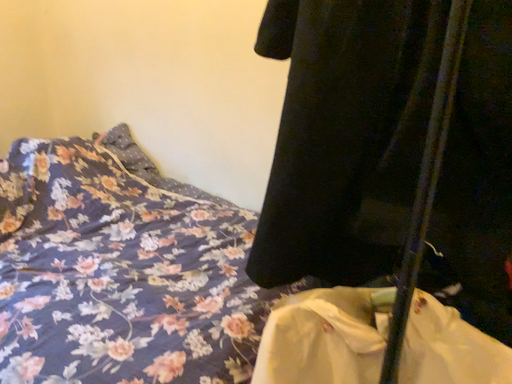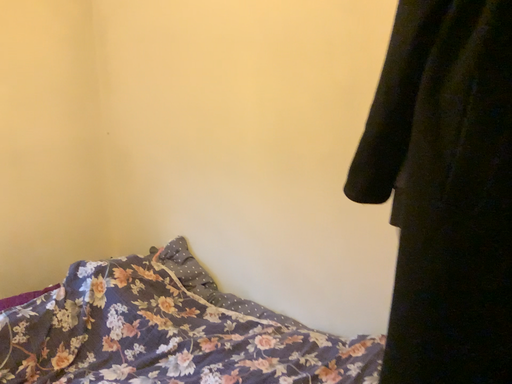
Question: How did the camera likely rotate when shooting the video?

Choices:
 (A) rotated right
 (B) rotated left

Answer: (B)